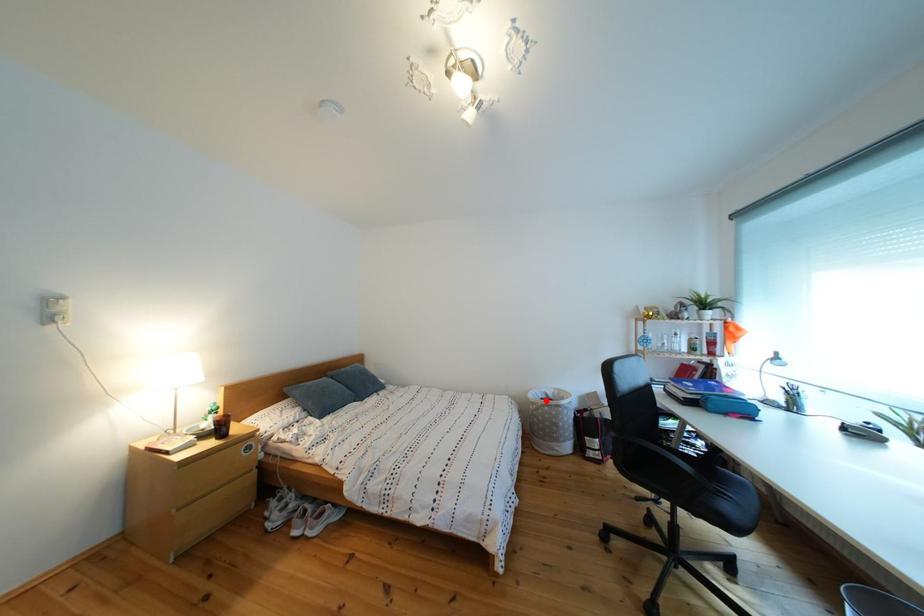
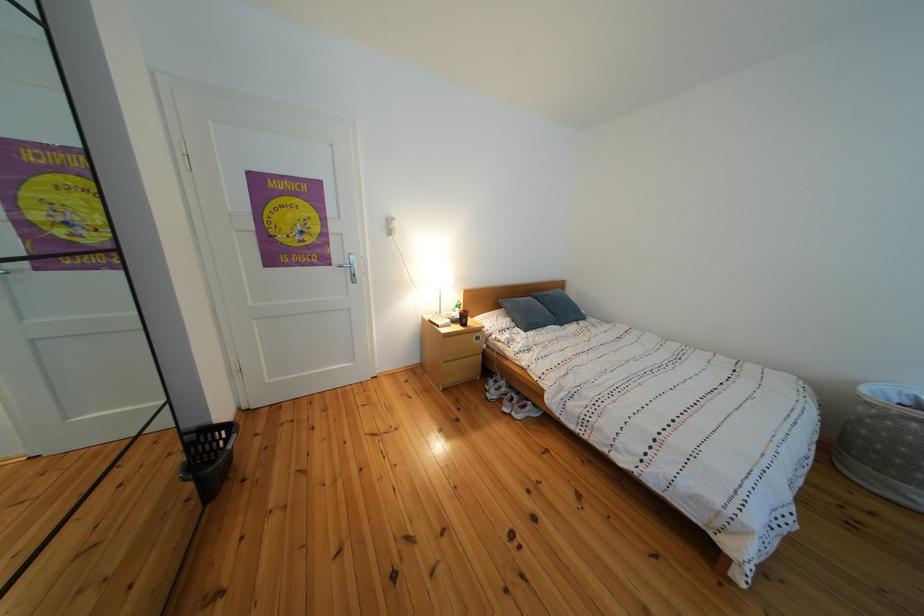
Question: I am providing you with two images of the same scene from different viewpoints. A red point is marked on the first image. At the location where the point appears in image 1, is it still visible in image 2?

Choices:
 (A) Yes
 (B) No

Answer: (A)